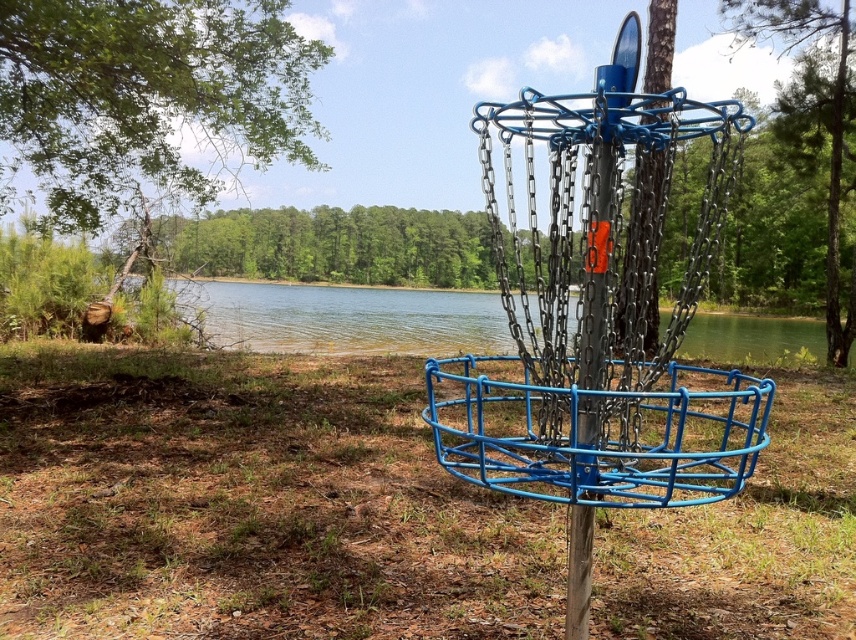
Does blue metallic basket at center have a greater width compared to green textured tree at upper right?

In fact, blue metallic basket at center might be narrower than green textured tree at upper right.

Does blue metallic basket at center have a lesser height compared to green textured tree at upper right?

Indeed, blue metallic basket at center has a lesser height compared to green textured tree at upper right.

Find the location of a particular element. blue metallic basket at center is located at coordinates (597, 433).

Is the position of green leafy tree at upper left less distant than that of clear water at center?

No, it is behind clear water at center.

Between point (58, 180) and point (253, 282), which one is positioned behind?

The point (253, 282) is behind.

Which is in front, point (82, 228) or point (340, 317)?

Point (82, 228) is in front.

Where is `green leafy tree at upper left`? This screenshot has width=856, height=640. green leafy tree at upper left is located at coordinates (146, 97).

Who is lower down, green leafy tree at center or green textured tree at upper right?

green textured tree at upper right

Between point (214, 273) and point (835, 28), which one is positioned in front?

Point (835, 28) is more forward.

You are a GUI agent. You are given a task and a screenshot of the screen. Output one action in this format:
    pyautogui.click(x=<x>, y=<y>)
    Task: Click on the green leafy tree at center
    This screenshot has width=856, height=640.
    Given the screenshot: What is the action you would take?
    pyautogui.click(x=333, y=244)